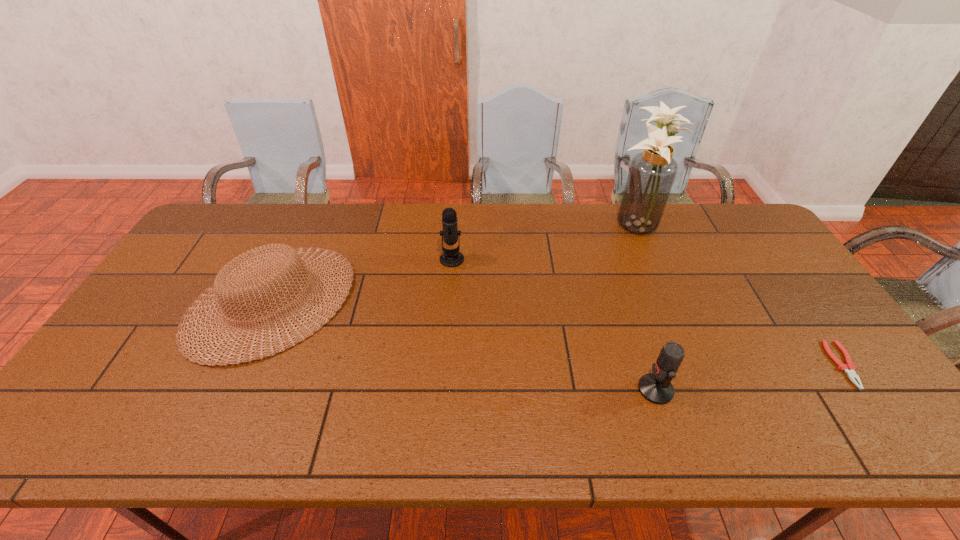
Identify the location of vacant space at the far edge of the desktop. The width and height of the screenshot is (960, 540). (357, 213).

Where is `free region at the near edge of the desktop`? This screenshot has width=960, height=540. free region at the near edge of the desktop is located at coordinates coord(313,421).

The image size is (960, 540). In the image, there is a desktop. Find the location of `vacant space at the left edge`. vacant space at the left edge is located at coordinates (170, 336).

This screenshot has width=960, height=540. Find the location of `free space at the far right corner`. free space at the far right corner is located at coordinates (736, 234).

This screenshot has width=960, height=540. In the image, there is a desktop. In order to click on vacant area at the near right corner in this screenshot , I will do `click(885, 446)`.

Locate an element on the screen. vacant region between the farther microphone and the shorter microphone is located at coordinates (554, 325).

At what (x,y) coordinates should I click in order to perform the action: click on vacant space that's between the pliers and the farther microphone. Please return your answer as a coordinate pair (x, y). This screenshot has width=960, height=540. Looking at the image, I should click on (648, 312).

Identify the location of free space between the sunhat and the farther microphone. (362, 280).

In order to click on free spot between the rightmost object and the farthest object in this screenshot , I will do `click(739, 294)`.

This screenshot has height=540, width=960. I want to click on empty space between the fourth tallest object and the pliers, so click(558, 333).